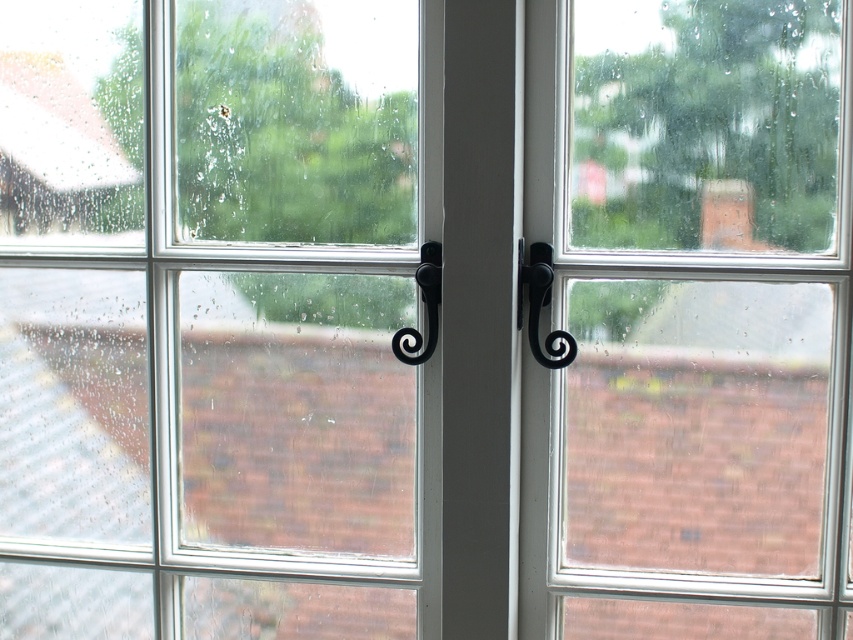
Does black matte door handle at center-right have a greater width compared to black matte door handle at center?

Yes, black matte door handle at center-right is wider than black matte door handle at center.

Image resolution: width=853 pixels, height=640 pixels. Describe the element at coordinates (541, 305) in the screenshot. I see `black matte door handle at center-right` at that location.

Is point (549, 339) closer to camera compared to point (437, 250)?

Yes, it is.

Locate an element on the screen. This screenshot has height=640, width=853. black matte door handle at center-right is located at coordinates (541, 305).

Measure the distance between clear glass window at center and black matte door handle at center-right.

They are 35.43 centimeters apart.

Is clear glass window at center bigger than black matte door handle at center-right?

Yes, clear glass window at center is bigger than black matte door handle at center-right.

Locate an element on the screen. clear glass window at center is located at coordinates [x=209, y=320].

Is clear glass window at right shorter than black matte door handle at center?

In fact, clear glass window at right may be taller than black matte door handle at center.

Does clear glass window at right have a greater width compared to black matte door handle at center?

Correct, the width of clear glass window at right exceeds that of black matte door handle at center.

You are a GUI agent. You are given a task and a screenshot of the screen. Output one action in this format:
    pyautogui.click(x=<x>, y=<y>)
    Task: Click on the clear glass window at right
    This screenshot has height=640, width=853.
    Given the screenshot: What is the action you would take?
    pyautogui.click(x=689, y=321)